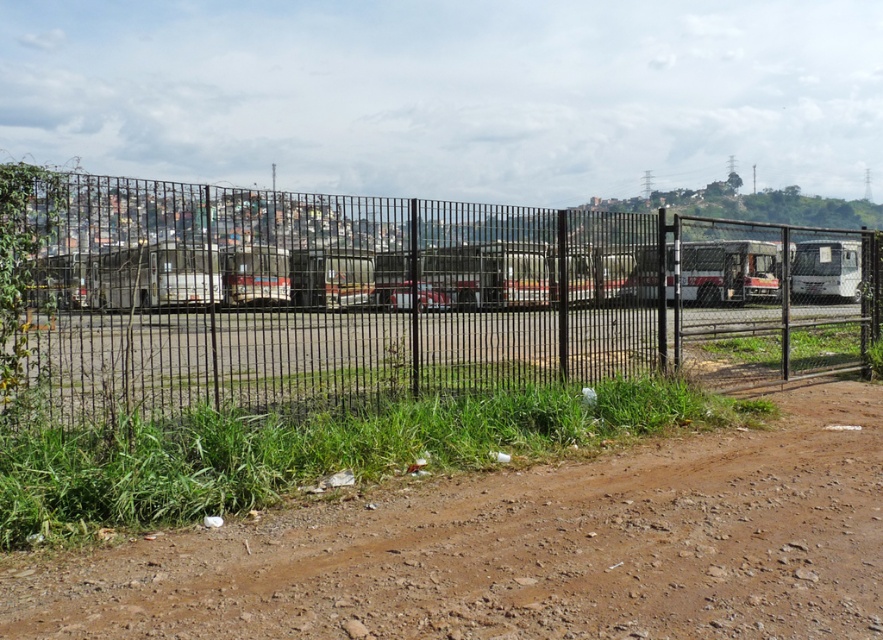
Is black metal fence at center wider than brown dirt field at lower left?

Yes.

Who is more forward, (x=153, y=307) or (x=743, y=444)?

Point (x=743, y=444) is in front.

I want to click on black metal fence at center, so click(389, 296).